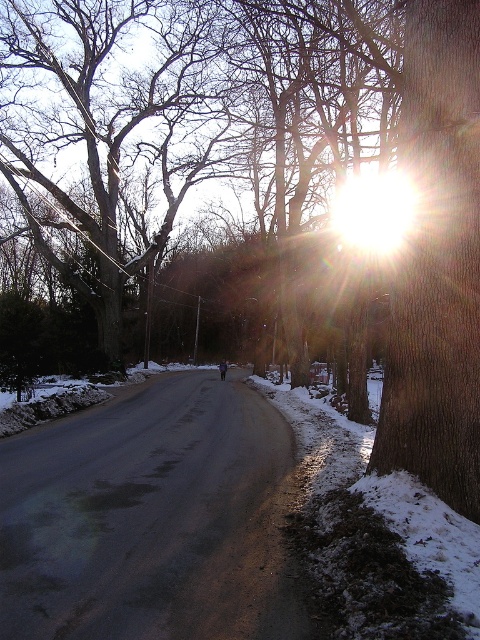
Question: In this image, where is smooth bark tree at left located relative to smooth brown bark at right?

Choices:
 (A) right
 (B) left

Answer: (B)

Question: In this image, where is smooth bark tree at left located relative to smooth brown bark at right?

Choices:
 (A) above
 (B) below

Answer: (A)

Question: Which object appears farthest from the camera in this image?

Choices:
 (A) smooth bark tree at left
 (B) smooth brown bark at right

Answer: (A)

Question: Does smooth bark tree at left appear under smooth brown bark at right?

Choices:
 (A) no
 (B) yes

Answer: (A)